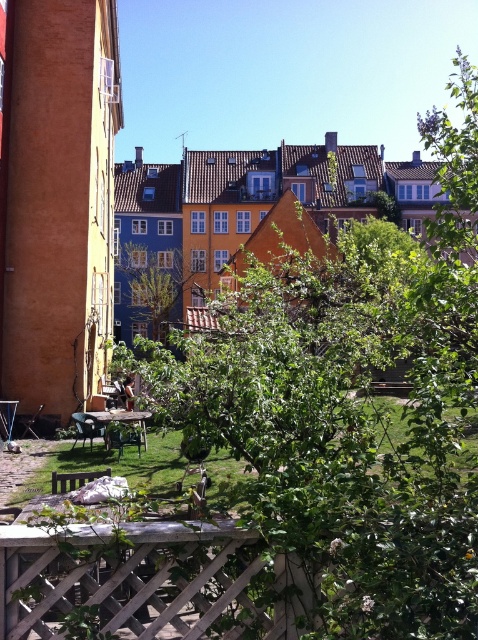
Question: Among these points, which one is farthest from the camera?

Choices:
 (A) (148, 292)
 (B) (161, 532)

Answer: (A)

Question: Which point is farther to the camera?

Choices:
 (A) (206, 637)
 (B) (160, 273)

Answer: (B)

Question: From the image, what is the correct spatial relationship of wooden lattice at lower center in relation to green leafy tree at center?

Choices:
 (A) right
 (B) left

Answer: (A)

Question: Is wooden lattice at lower center below green leafy tree at center?

Choices:
 (A) no
 (B) yes

Answer: (B)

Question: Can you confirm if wooden lattice at lower center is positioned below green leafy tree at center?

Choices:
 (A) yes
 (B) no

Answer: (A)

Question: Which point is farther to the camera?

Choices:
 (A) green leafy tree at center
 (B) wooden lattice at lower center

Answer: (A)